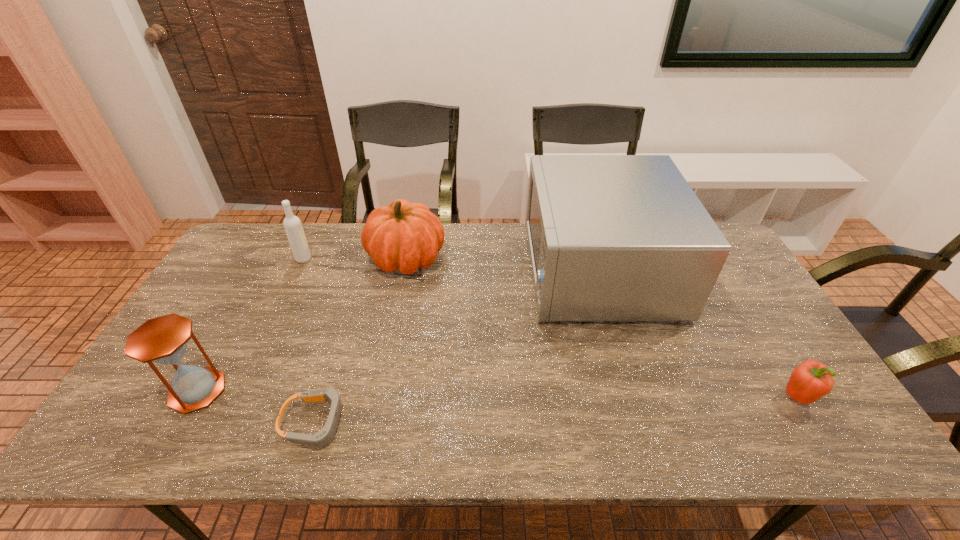
The height and width of the screenshot is (540, 960). In order to click on free space between the fifth object from left to right and the hourglass in this screenshot , I will do `click(397, 329)`.

Identify the location of free space between the vodka and the pumpkin. (355, 258).

Find the location of a particular element. vacant space that's between the goggles and the pumpkin is located at coordinates (361, 340).

This screenshot has height=540, width=960. In order to click on free space that is in between the pumpkin and the shortest object in this screenshot , I will do `click(361, 340)`.

Where is `vacant space in between the pumpkin and the fifth object from right to left`? The image size is (960, 540). vacant space in between the pumpkin and the fifth object from right to left is located at coordinates (355, 258).

Identify the location of vacant area that lies between the leftmost object and the microwave oven. (397, 329).

Image resolution: width=960 pixels, height=540 pixels. I want to click on free space between the vodka and the pepper, so click(550, 328).

I want to click on object that is the third closest one to the second shortest object, so click(323, 437).

Identify the location of object that is the third nearest to the pumpkin. (323, 437).

The image size is (960, 540). I want to click on free space that satisfies the following two spatial constraints: 1. on the front side of the pumpkin; 2. on the front and back of the goggles, so click(x=374, y=423).